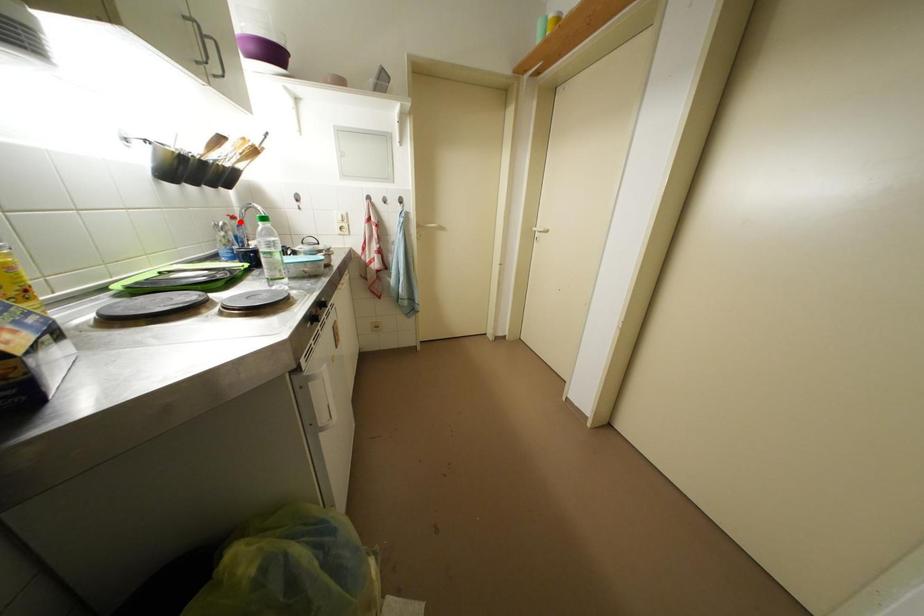
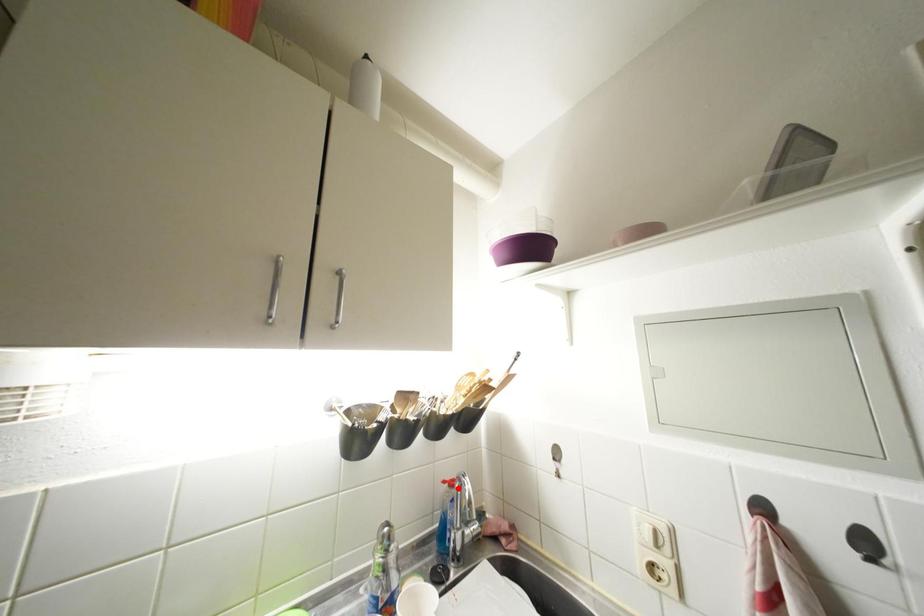
I am providing you with two images of the same scene from different viewpoints. A red point is marked on the first image and another point is marked on the second image. Is the red point in image1 aligned with the point shown in image2?

Yes